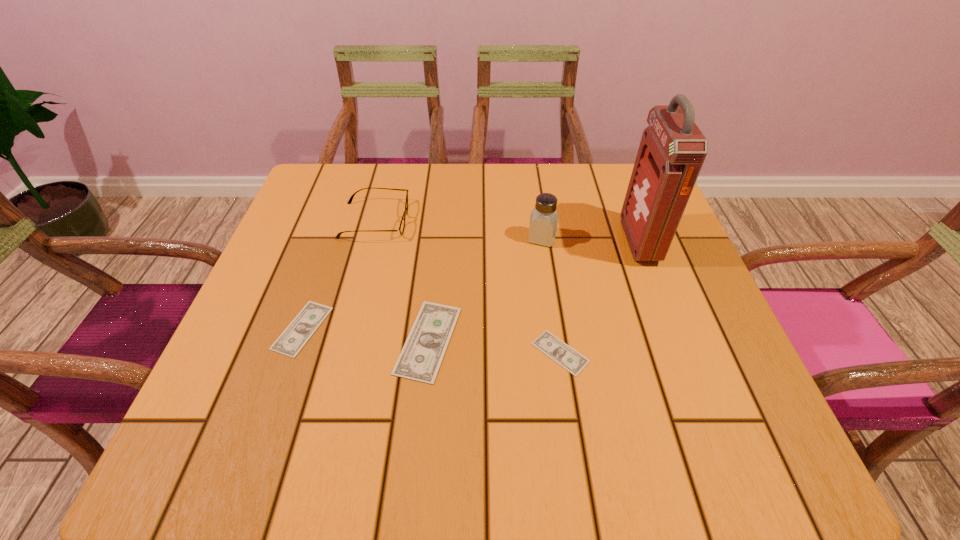
Identify which object is located as the third nearest to the second tallest object. Please provide its 2D coordinates. Your answer should be formatted as a tuple, i.e. [(x, y)], where the tuple contains the x and y coordinates of a point satisfying the conditions above.

[(550, 345)]

This screenshot has width=960, height=540. Identify the location of object that is the second closest to the shortest money. (672, 150).

This screenshot has height=540, width=960. In order to click on money that stands as the third closest to the tallest object in this screenshot , I will do `click(300, 330)`.

Where is `money that can be found as the third closest to the spectacles`? This screenshot has height=540, width=960. money that can be found as the third closest to the spectacles is located at coordinates point(550,345).

At what (x,y) coordinates should I click in order to perform the action: click on free space in the image that satisfies the following two spatial constraints: 1. on the front-facing side of the spectacles; 2. on the front side of the second shortest object. Please return your answer as a coordinate pair (x, y). Looking at the image, I should click on point(347,328).

Find the location of a particular element. Image resolution: width=960 pixels, height=540 pixels. blank space that satisfies the following two spatial constraints: 1. on the front-facing side of the spectacles; 2. on the back side of the second tallest object is located at coordinates (371, 238).

The height and width of the screenshot is (540, 960). I want to click on vacant area in the image that satisfies the following two spatial constraints: 1. on the front-facing side of the spectacles; 2. on the left side of the second money from left to right, so click(x=344, y=340).

Where is `free region that satisfies the following two spatial constraints: 1. on the back side of the tallest money; 2. on the right side of the fifth shortest object`? free region that satisfies the following two spatial constraints: 1. on the back side of the tallest money; 2. on the right side of the fifth shortest object is located at coordinates (439, 238).

Find the location of a particular element. Image resolution: width=960 pixels, height=540 pixels. free location that satisfies the following two spatial constraints: 1. on the front-facing side of the saltshaker; 2. on the right side of the fourth shortest object is located at coordinates (371, 238).

Identify the location of free region that satisfies the following two spatial constraints: 1. on the front-facing side of the fourth shortest object; 2. on the back side of the saltshaker. This screenshot has width=960, height=540. (371, 238).